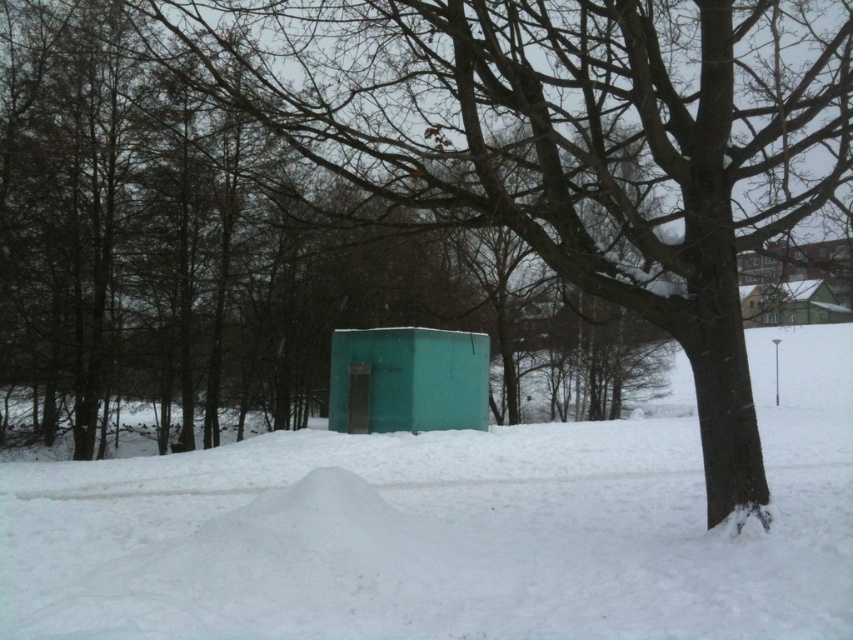
Question: Is white fluffy snow at center closer to camera compared to green matte shed at upper right?

Choices:
 (A) no
 (B) yes

Answer: (B)

Question: Which object is farther from the camera taking this photo?

Choices:
 (A) green matte shed at upper right
 (B) white fluffy snow at center

Answer: (A)

Question: Which point is closer to the camera?

Choices:
 (A) (380, 392)
 (B) (408, 518)

Answer: (B)

Question: Is green matte shelter at center closer to the viewer compared to green matte shed at upper right?

Choices:
 (A) yes
 (B) no

Answer: (B)

Question: Among these objects, which one is nearest to the camera?

Choices:
 (A) green matte shelter at center
 (B) green matte shed at upper right

Answer: (B)

Question: Observing the image, what is the correct spatial positioning of white fluffy snow at center in reference to green matte shed at upper right?

Choices:
 (A) left
 (B) right

Answer: (A)